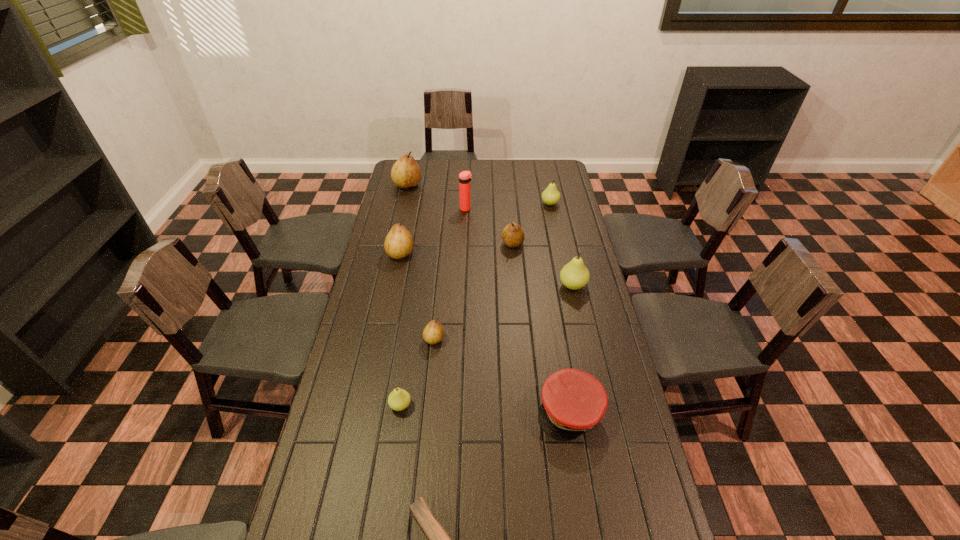
The image size is (960, 540). I want to click on the seventh closest object relative to the cap, so click(465, 177).

At what (x,y) coordinates should I click in order to perform the action: click on the second closest pear to the biggest brown pear. Please return your answer as a coordinate pair (x, y). Looking at the image, I should click on (513, 236).

Locate which pear ranks fourth in proximity to the second farthest pear. Please provide its 2D coordinates. Your answer should be formatted as a tuple, i.e. [(x, y)], where the tuple contains the x and y coordinates of a point satisfying the conditions above.

[(398, 244)]

Where is `the closest brown pear to the farthest brown pear`? Image resolution: width=960 pixels, height=540 pixels. the closest brown pear to the farthest brown pear is located at coordinates (398, 244).

Find the location of `the closest brown pear to the biggest green pear`. the closest brown pear to the biggest green pear is located at coordinates (513, 236).

The image size is (960, 540). Identify the location of green pear that stands as the second closest to the second biggest brown pear. (399, 399).

Select which green pear is the closest to the third smallest brown pear. Please provide its 2D coordinates. Your answer should be formatted as a tuple, i.e. [(x, y)], where the tuple contains the x and y coordinates of a point satisfying the conditions above.

[(574, 275)]

The image size is (960, 540). I want to click on free space that satisfies the following two spatial constraints: 1. on the back side of the thermos bottle; 2. on the right side of the third pear from left to right, so click(429, 209).

Where is `blank area in the image that satisfies the following two spatial constraints: 1. on the front side of the farthest brown pear; 2. on the right side of the smallest brown pear`? This screenshot has width=960, height=540. blank area in the image that satisfies the following two spatial constraints: 1. on the front side of the farthest brown pear; 2. on the right side of the smallest brown pear is located at coordinates (372, 339).